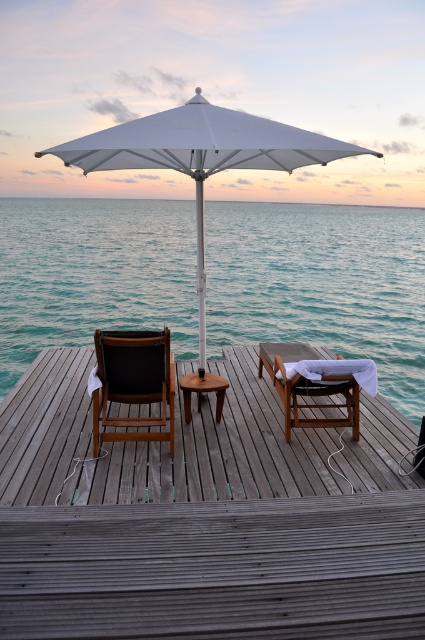
Is white fabric umbrella at center below brown wooden stool at center?

Incorrect, white fabric umbrella at center is not positioned below brown wooden stool at center.

The image size is (425, 640). What do you see at coordinates (201, 154) in the screenshot?
I see `white fabric umbrella at center` at bounding box center [201, 154].

The height and width of the screenshot is (640, 425). I want to click on white fabric umbrella at center, so click(201, 154).

Does wooden beach chair at center appear on the right side of brown wooden stool at center?

Yes, wooden beach chair at center is to the right of brown wooden stool at center.

Does wooden beach chair at center have a lesser height compared to brown wooden stool at center?

In fact, wooden beach chair at center may be taller than brown wooden stool at center.

This screenshot has width=425, height=640. Describe the element at coordinates (316, 397) in the screenshot. I see `wooden beach chair at center` at that location.

Locate an element on the screen. Image resolution: width=425 pixels, height=640 pixels. wooden beach chair at center is located at coordinates (316, 397).

Who is positioned more to the right, wooden at center or wooden beach chair at center?

wooden beach chair at center is more to the right.

Can you confirm if wooden at center is wider than wooden beach chair at center?

Correct, the width of wooden at center exceeds that of wooden beach chair at center.

Between point (363, 496) and point (328, 406), which one is positioned behind?

Point (328, 406)

The image size is (425, 640). Find the location of `wooden at center`. wooden at center is located at coordinates (204, 518).